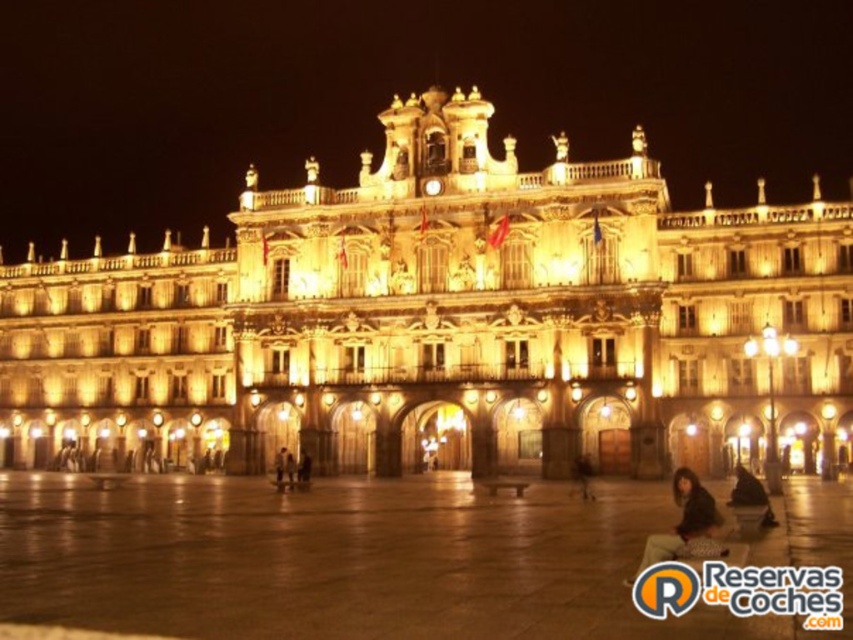
You are standing in front of a historical building at night. The golden stone building at center is the main structure you are facing. If you want to take a photo of the entire building without moving your position, what should you do?

Since the golden stone building at center is 67.08 meters away from you, you can use a wide angle lens to capture the entire structure in one shot.

You are standing in the plaza in front of the golden stone building at center and notice a dark fabric bag at lower right. Which object is bigger in size?

The golden stone building at center is larger in size compared to the dark fabric bag at lower right.